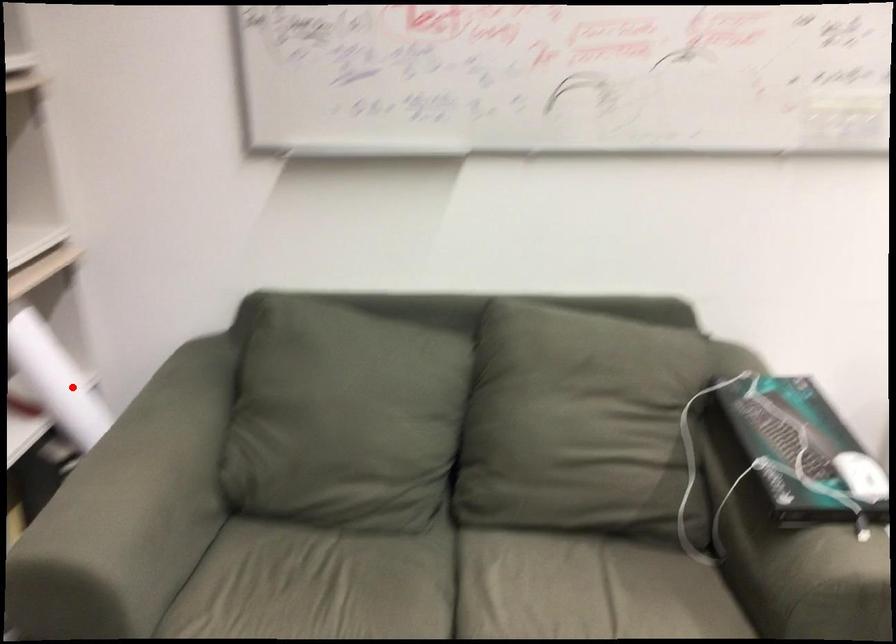
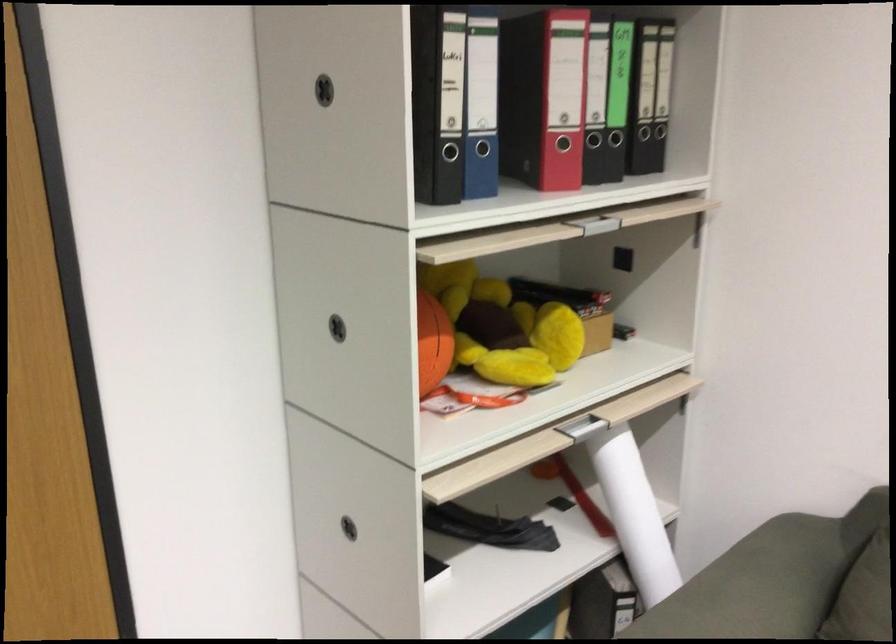
Where in the second image is the point corresponding to the highlighted location from the first image?

(633, 514)